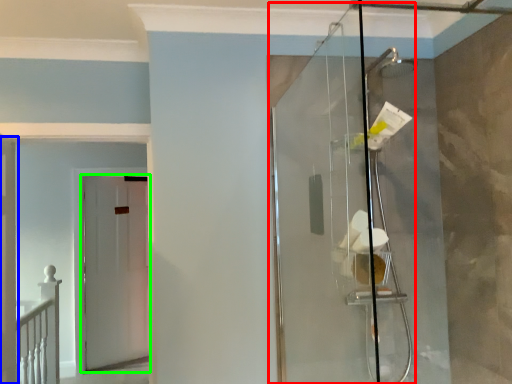
Question: Based on their relative distances, which object is nearer to glass door (highlighted by a red box)? Choose from door (highlighted by a blue box) and door (highlighted by a green box).

Choices:
 (A) door
 (B) door

Answer: (A)